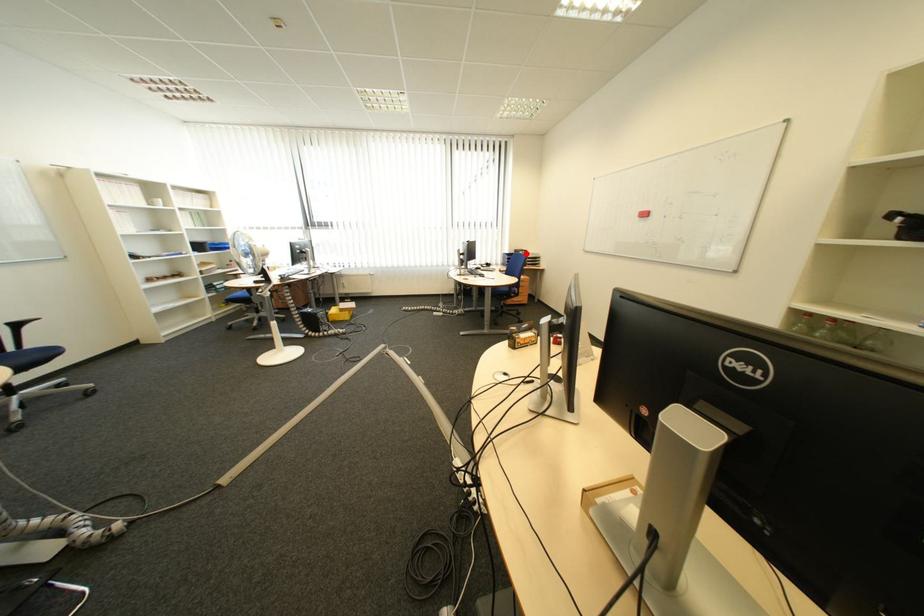
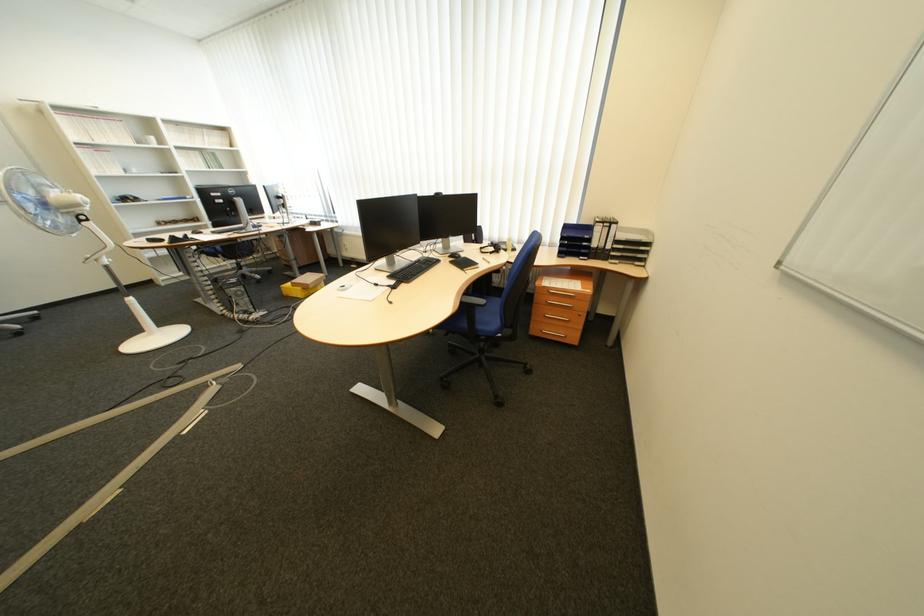
Question: A red point is marked in image1. In image2, is the corresponding 3D point closer to the camera or farther? Reply with the corresponding letter.

Choices:
 (A) The corresponding 3D point is closer.
 (B) The corresponding 3D point is farther.

Answer: (B)